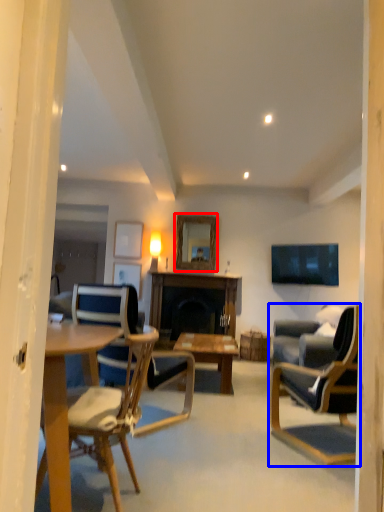
Question: Which point is further to the camera, mirror (highlighted by a red box) or chair (highlighted by a blue box)?

Choices:
 (A) mirror
 (B) chair

Answer: (A)